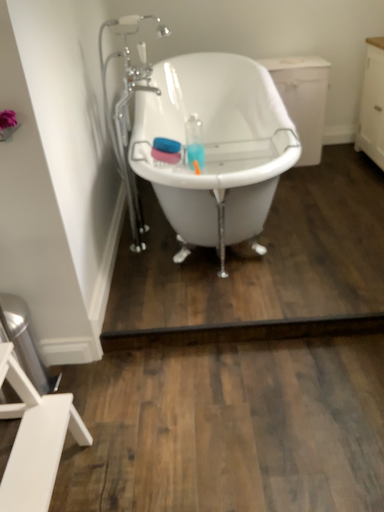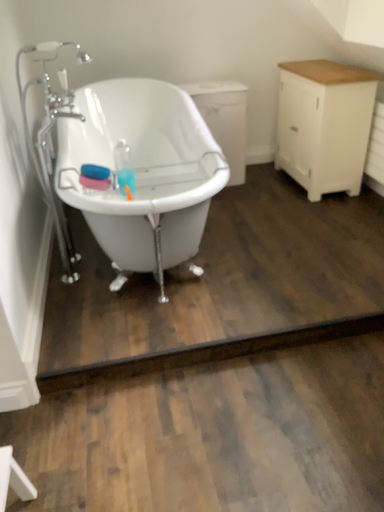
Question: Which way did the camera rotate in the video?

Choices:
 (A) rotated left
 (B) rotated right

Answer: (B)